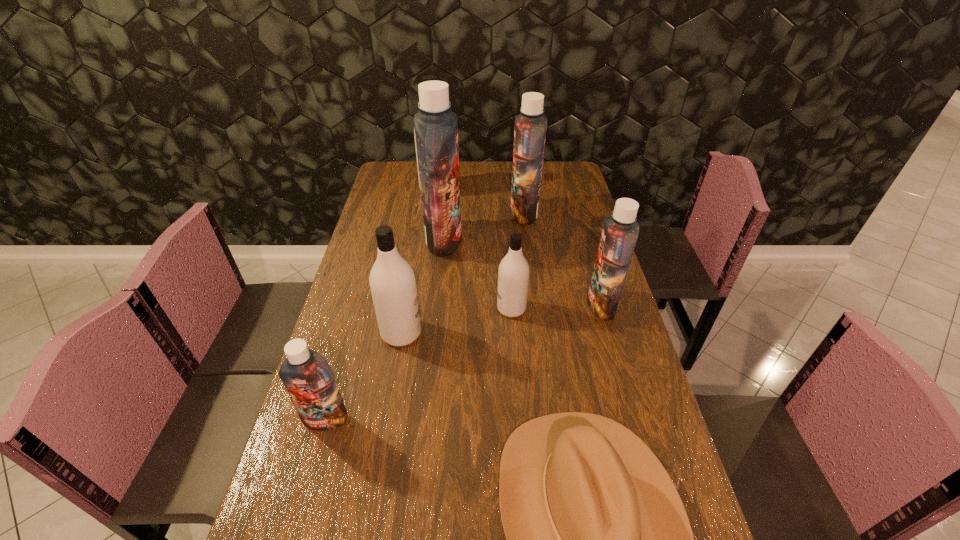
You are a GUI agent. You are given a task and a screenshot of the screen. Output one action in this format:
    pyautogui.click(x=<x>, y=<y>)
    Task: Click on the vacant region located 0.160m on the front-facing side of the smallest white shampoo
    This screenshot has height=540, width=960.
    Given the screenshot: What is the action you would take?
    pyautogui.click(x=444, y=308)

I want to click on vacant region located 0.350m on the front-facing side of the smallest white shampoo, so click(x=381, y=308).

Identify the location of free space located on the front-facing side of the smallest white shampoo. (423, 308).

Locate an element on the screen. This screenshot has width=960, height=540. vacant region located 0.220m on the front label of the nearest shampoo is located at coordinates (292, 535).

Image resolution: width=960 pixels, height=540 pixels. Identify the location of object present at the far edge. [428, 77].

Where is `object that is positioned at the right edge`? The image size is (960, 540). object that is positioned at the right edge is located at coordinates (620, 232).

This screenshot has height=540, width=960. I want to click on free spot at the far edge of the desktop, so click(471, 171).

Locate an element on the screen. The image size is (960, 540). vacant area at the left edge of the desktop is located at coordinates (372, 382).

What are the coordinates of `free point between the biggest white shampoo and the second biggest blue shampoo` in the screenshot? It's located at (481, 201).

This screenshot has height=540, width=960. Find the location of `free spot between the farthest shampoo and the second biggest white shampoo`. free spot between the farthest shampoo and the second biggest white shampoo is located at coordinates (420, 261).